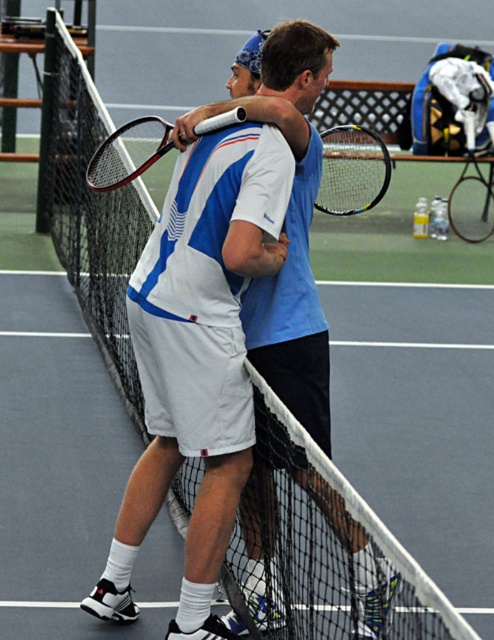
Is white matte tennis racket at upper center closer to camera compared to matte black tennis racket at upper center?

Yes, it is.

Which of these two, white matte tennis racket at upper center or matte black tennis racket at upper center, stands shorter?

With less height is matte black tennis racket at upper center.

Where is `white matte tennis racket at upper center`? white matte tennis racket at upper center is located at coordinates (198, 358).

Is black rubber tennis racket at center wider than black matte tennis racket at center?

Incorrect, black rubber tennis racket at center's width does not surpass black matte tennis racket at center's.

This screenshot has width=494, height=640. What do you see at coordinates (352, 170) in the screenshot? I see `black rubber tennis racket at center` at bounding box center [352, 170].

Does point (368, 140) lie in front of point (458, 218)?

Yes, it is.

The width and height of the screenshot is (494, 640). I want to click on black rubber tennis racket at center, so click(352, 170).

Is white matte tennis racket at upper center positioned in front of black matte tennis racket at center?

Yes, it is.

Does point (223, 387) come closer to viewer compared to point (463, 218)?

That is True.

Locate an element on the screen. This screenshot has width=494, height=640. white matte tennis racket at upper center is located at coordinates (198, 358).